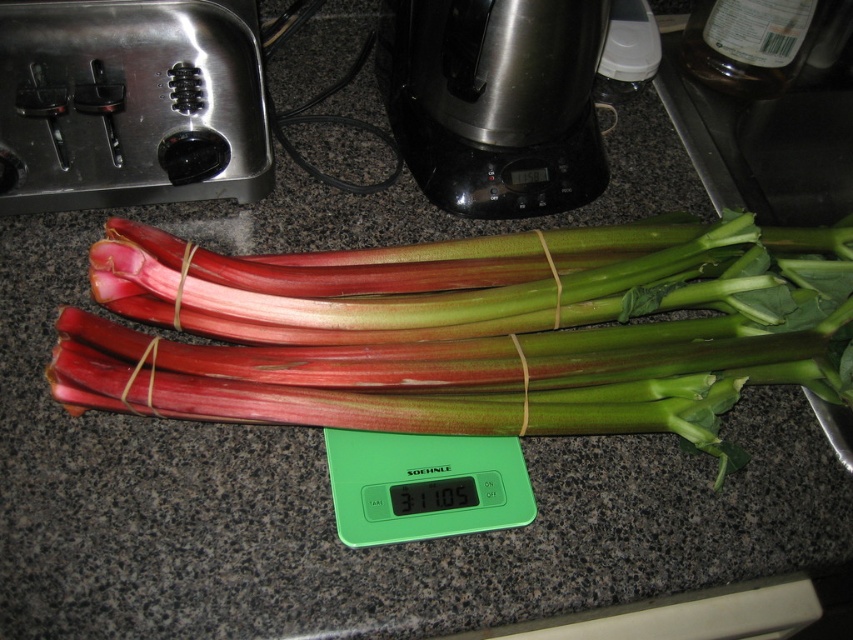
You are a delivery person who needs to place a package on the kitchen countertop. The package must be placed at a point closer to the camera than the bundle of rhubarb. Which of the two points, point (670, 237) or point (469, 467), should you choose?

Point (670, 237) is further to the camera than point (469, 467). Therefore, to place the package closer to the camera than the bundle of rhubarb, you should choose point (469, 467).

You are a chef standing in front of the kitchen countertop. You need to quickly grab the stainless steel blender at center to blend some ingredients. Considering your arm length is 24 inches, can you reach it without moving your feet?

The stainless steel blender at center is 25.65 inches away from viewer. Since your arm length is 24 inches, you cannot reach it without moving your feet.